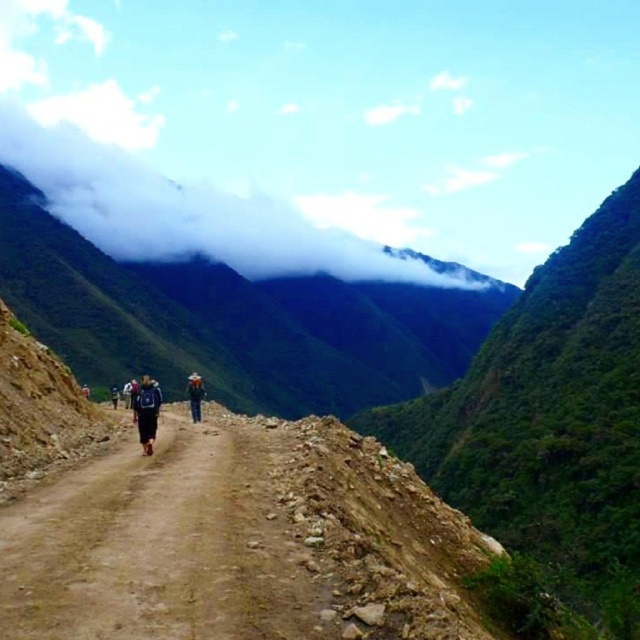
Who is lower down, white fluffy cloud at upper center or brown fabric hat at center?

brown fabric hat at center is below.

Between white fluffy cloud at upper center and brown fabric hat at center, which one appears on the right side from the viewer's perspective?

brown fabric hat at center is more to the right.

Between point (188, 236) and point (188, 387), which one is positioned in front?

Point (188, 387)

Where is `white fluffy cloud at upper center`? white fluffy cloud at upper center is located at coordinates (195, 212).

Is dark blue backpack at center bigger than brown fabric hat at center?

Incorrect, dark blue backpack at center is not larger than brown fabric hat at center.

How distant is dark blue backpack at center from brown fabric hat at center?

The distance of dark blue backpack at center from brown fabric hat at center is 87.70 feet.

You are a GUI agent. You are given a task and a screenshot of the screen. Output one action in this format:
    pyautogui.click(x=<x>, y=<y>)
    Task: Click on the dark blue backpack at center
    The height and width of the screenshot is (640, 640).
    Given the screenshot: What is the action you would take?
    pyautogui.click(x=147, y=412)

Does brown dirt track at center have a greater width compared to dark blue backpack at center?

Incorrect, brown dirt track at center's width does not surpass dark blue backpack at center's.

Consider the image. Is brown dirt track at center smaller than dark blue backpack at center?

Indeed, brown dirt track at center has a smaller size compared to dark blue backpack at center.

This screenshot has width=640, height=640. Describe the element at coordinates (161, 547) in the screenshot. I see `brown dirt track at center` at that location.

You are a GUI agent. You are given a task and a screenshot of the screen. Output one action in this format:
    pyautogui.click(x=<x>, y=<y>)
    Task: Click on the brown dirt track at center
    This screenshot has width=640, height=640.
    Given the screenshot: What is the action you would take?
    pyautogui.click(x=161, y=547)